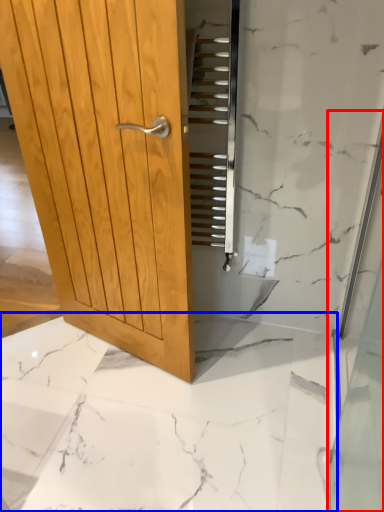
Question: Which object is closer to the camera taking this photo, shower door (highlighted by a red box) or granite (highlighted by a blue box)?

Choices:
 (A) shower door
 (B) granite

Answer: (A)